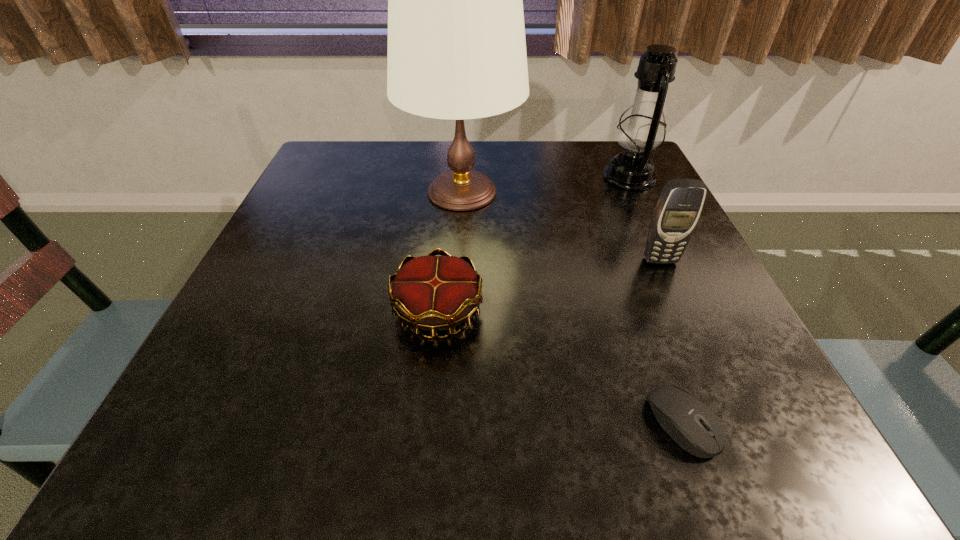
You are a GUI agent. You are given a task and a screenshot of the screen. Output one action in this format:
    pyautogui.click(x=<x>, y=<y>)
    Task: Click on the vacant space situated 0.130m on the front face of the third shortest object
    
    Given the screenshot: What is the action you would take?
    pyautogui.click(x=686, y=319)

Find the location of a particular element. The image size is (960, 540). free region located on the back of the second nearest object is located at coordinates (448, 200).

Identify the location of free space located on the left of the shortest object. (507, 422).

Identify the location of lamp positioned at the far edge. (456, 37).

Identify the location of oil lamp that is positioned at the far edge. (641, 130).

Where is `object present at the near edge`? Image resolution: width=960 pixels, height=540 pixels. object present at the near edge is located at coordinates (688, 421).

In order to click on oil lamp situated at the right edge in this screenshot , I will do `click(641, 130)`.

Where is `cellular telephone that is at the right edge`? cellular telephone that is at the right edge is located at coordinates (679, 206).

The height and width of the screenshot is (540, 960). Find the location of `computer equipment that is at the right edge`. computer equipment that is at the right edge is located at coordinates (688, 421).

I want to click on object that is at the far right corner, so click(x=641, y=130).